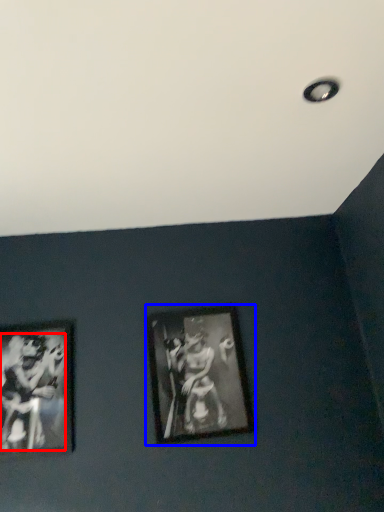
Question: Which object appears closest to the camera in this image, person (highlighted by a red box) or picture frame (highlighted by a blue box)?

Choices:
 (A) person
 (B) picture frame

Answer: (A)